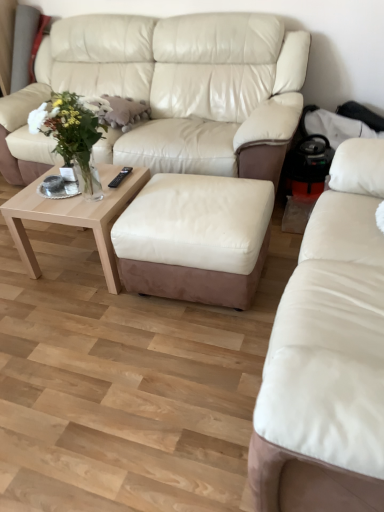
I want to click on free region under translucent glass vase at center (from a real-world perspective), so click(102, 196).